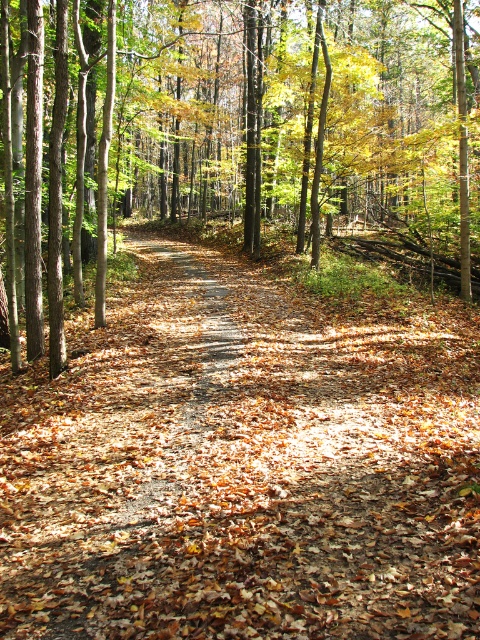
Question: In this image, where is brown leafy forest path at center located relative to brown leaf litter at center?

Choices:
 (A) below
 (B) above

Answer: (A)

Question: Which object appears farthest from the camera in this image?

Choices:
 (A) brown leaf litter at center
 (B) brown leafy forest path at center

Answer: (A)

Question: Can you confirm if brown leafy forest path at center is smaller than brown leaf litter at center?

Choices:
 (A) no
 (B) yes

Answer: (B)

Question: Does brown leafy forest path at center have a greater width compared to brown leaf litter at center?

Choices:
 (A) yes
 (B) no

Answer: (B)

Question: Among these objects, which one is farthest from the camera?

Choices:
 (A) brown leaf litter at center
 (B) brown leafy forest path at center

Answer: (A)

Question: Among these points, which one is nearest to the camera?

Choices:
 (A) (60, 564)
 (B) (156, 122)

Answer: (A)